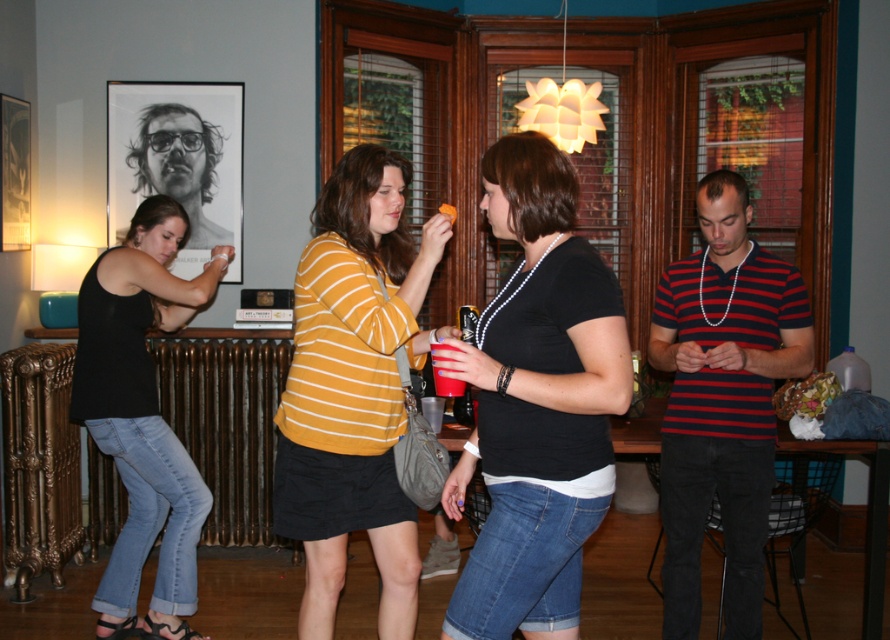
Question: Does black matte shirt at center appear over striped cotton shirt at right?

Choices:
 (A) yes
 (B) no

Answer: (A)

Question: Is black denim jeans at left positioned behind matte black portrait at upper left?

Choices:
 (A) yes
 (B) no

Answer: (B)

Question: Which object is closer to the camera taking this photo?

Choices:
 (A) matte black portrait at upper left
 (B) yellow striped shirt at center
 (C) striped cotton shirt at right
 (D) black denim jeans at left

Answer: (B)

Question: Does black denim jeans at left appear on the right side of matte plastic cup at center?

Choices:
 (A) yes
 (B) no

Answer: (B)

Question: Among these objects, which one is farthest from the camera?

Choices:
 (A) matte black portrait at upper left
 (B) black matte shirt at center

Answer: (A)

Question: Which point is closer to the camera?

Choices:
 (A) striped cotton shirt at right
 (B) black matte shirt at center
 (C) black denim jeans at left

Answer: (B)